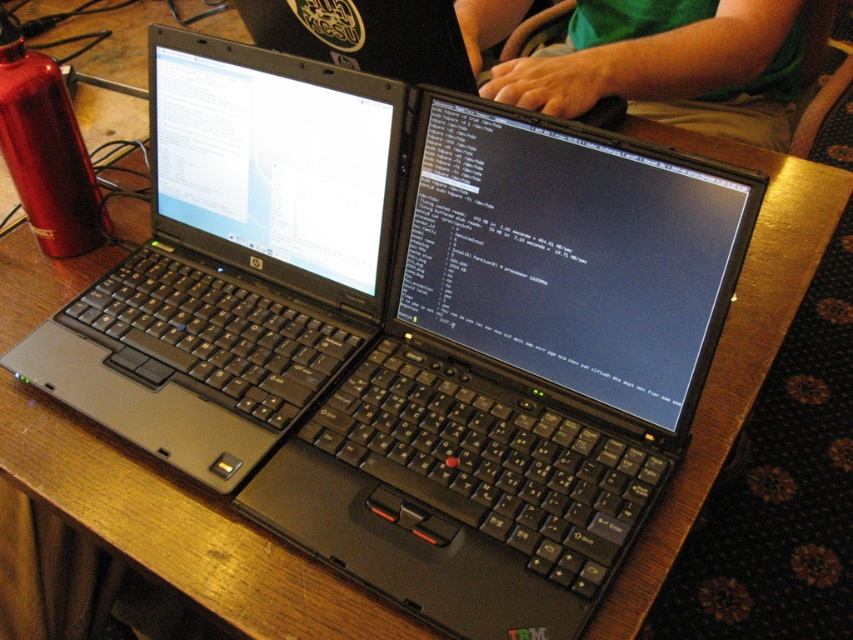
You are organizing a tech event and need to know the layout of the table setup. Are the black plastic laptop at center and the green fabric shirt at upper center arranged in a way that the shirt is above the laptop?

The black plastic laptop at center is positioned under green fabric shirt at upper center, so yes, the green fabric shirt at upper center is above the black plastic laptop at center.

You are a delivery robot that needs to deliver a package to a point located at point (218, 170). The robot has a maximum reach of 80 centimeters. Can you reach that point?

The distance of point (218, 170) from camera is 79.88 centimeters, so yes, the robot can reach that point since it is within the maximum reach of 80 centimeters.

Where is the black plastic laptop at center located in the image?

The black plastic laptop at center is located at point (234, 259) in the image.